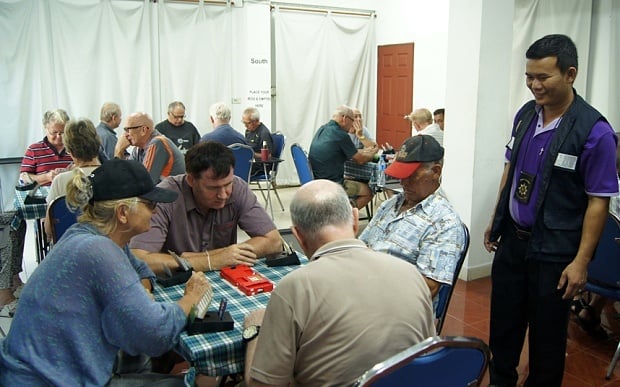
This screenshot has width=620, height=387. Identify the location of door. (396, 79).